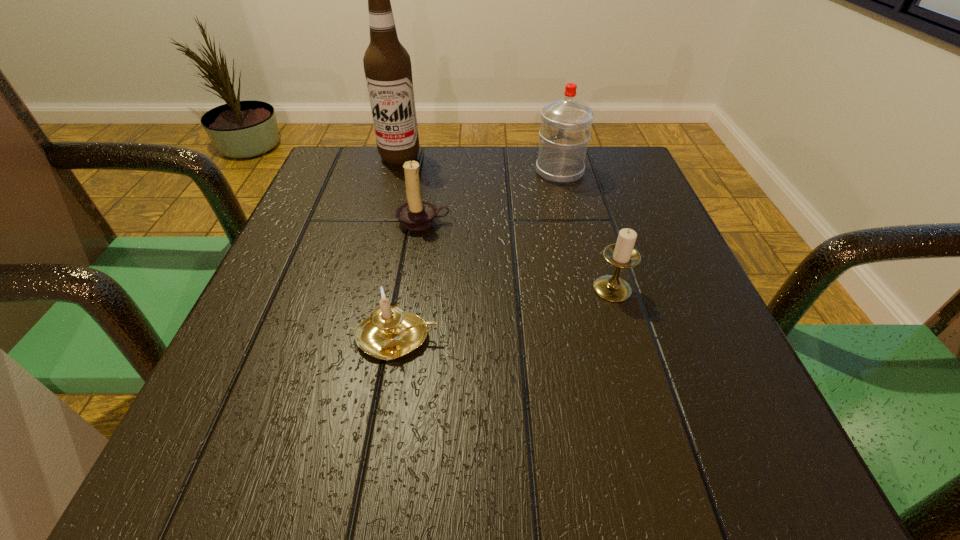
What are the coordinates of `alcohol` in the screenshot? It's located at (387, 65).

Locate an element on the screen. The width and height of the screenshot is (960, 540). water bottle is located at coordinates (565, 131).

This screenshot has width=960, height=540. I want to click on the farthest candle holder, so click(x=416, y=214).

Where is `the fourth farthest object`? The height and width of the screenshot is (540, 960). the fourth farthest object is located at coordinates (622, 254).

Locate an element on the screen. Image resolution: width=960 pixels, height=540 pixels. the second nearest candle holder is located at coordinates (622, 254).

You are a GUI agent. You are given a task and a screenshot of the screen. Output one action in this format:
    pyautogui.click(x=<x>, y=<y>)
    Task: Click on the nearest object
    The image size is (960, 540).
    Given the screenshot: What is the action you would take?
    pyautogui.click(x=389, y=333)

Find the location of a particular element. Image resolution: width=960 pixels, height=540 pixels. the nearest candle holder is located at coordinates (389, 333).

This screenshot has width=960, height=540. In order to click on vacant space located 0.140m on the label of the tallest object in this screenshot , I will do `click(388, 201)`.

Locate an element on the screen. free location located 0.340m on the wick of the farthest candle holder is located at coordinates (397, 389).

At what (x,y) coordinates should I click in order to perform the action: click on vacant area located on the back of the rightmost candle holder. Please return your answer as a coordinate pair (x, y). Image resolution: width=960 pixels, height=540 pixels. Looking at the image, I should click on (573, 159).